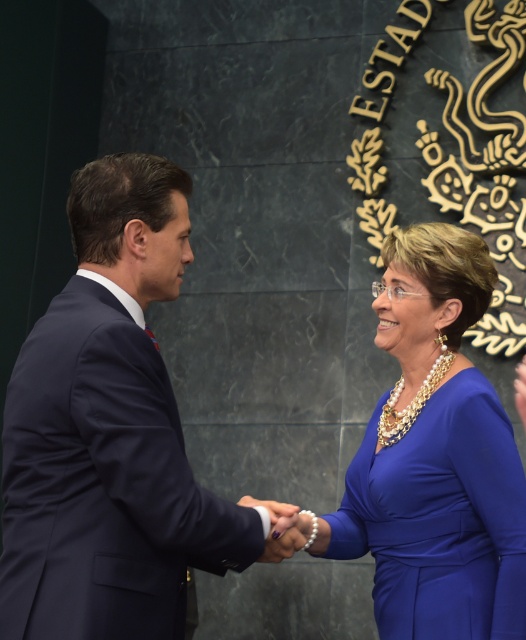
Does navy blue suit at center have a larger size compared to smooth leather hand at center?

Correct, navy blue suit at center is larger in size than smooth leather hand at center.

This screenshot has height=640, width=526. I want to click on navy blue suit at center, so click(x=112, y=433).

Who is more forward, (31, 518) or (521, 417)?

Positioned in front is point (31, 518).

Find the location of a particular element. This screenshot has height=640, width=526. navy blue suit at center is located at coordinates (112, 433).

Does point (504, 481) come closer to viewer compared to point (522, 400)?

Yes, it is.

Does blue satin dress at center appear on the left side of smooth leather hand at center?

Indeed, blue satin dress at center is positioned on the left side of smooth leather hand at center.

Between point (460, 541) and point (518, 394), which one is positioned in front?

Positioned in front is point (460, 541).

Identify the location of blue satin dress at center. Image resolution: width=526 pixels, height=640 pixels. (434, 458).

Which is behind, point (236, 554) or point (450, 228)?

The point (450, 228) is behind.

From the picture: Measure the distance between navy blue suit at center and camera.

navy blue suit at center is 60.39 feet away from camera.

Find the location of a particular element. The width and height of the screenshot is (526, 640). navy blue suit at center is located at coordinates (112, 433).